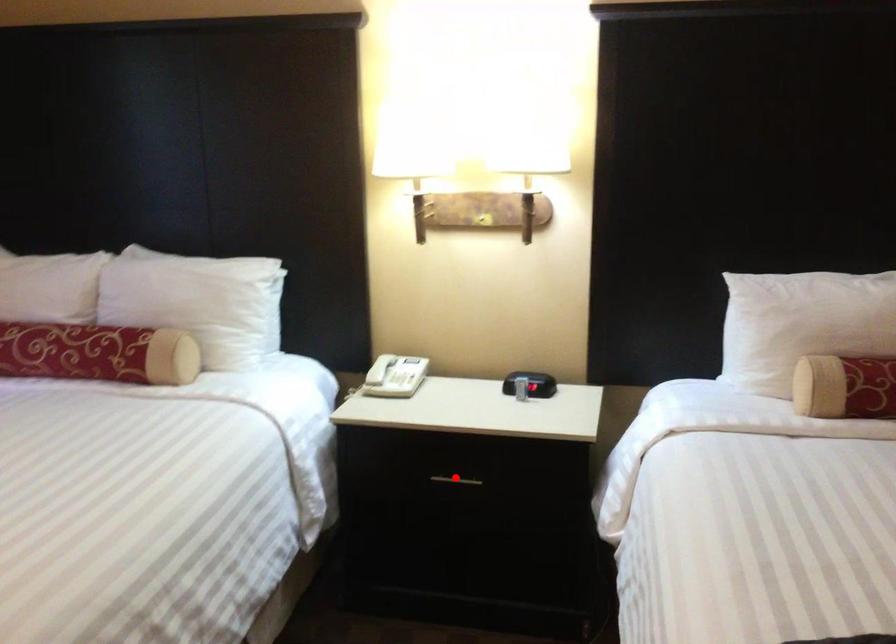
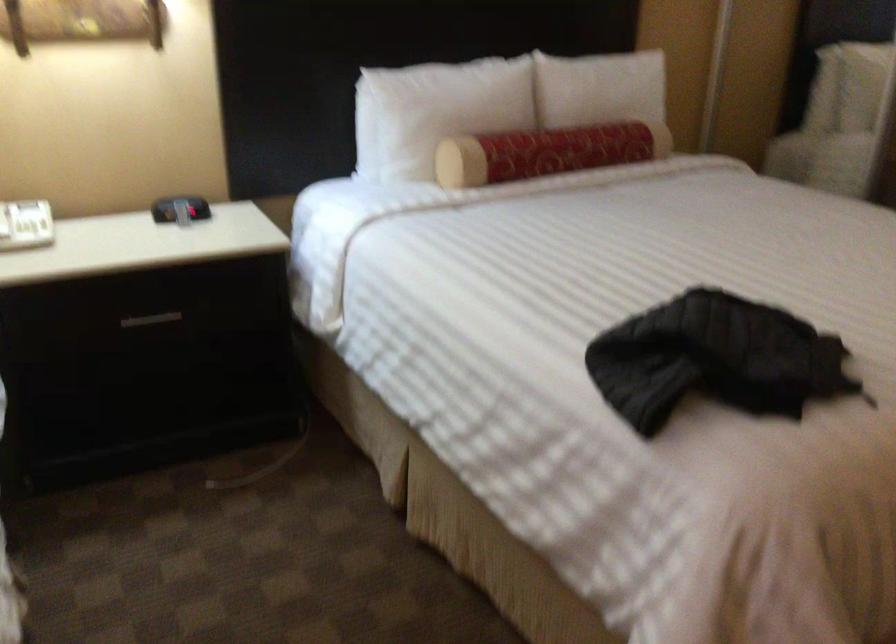
Find the pixel in the second image that matches the highlighted location in the first image.

(151, 319)